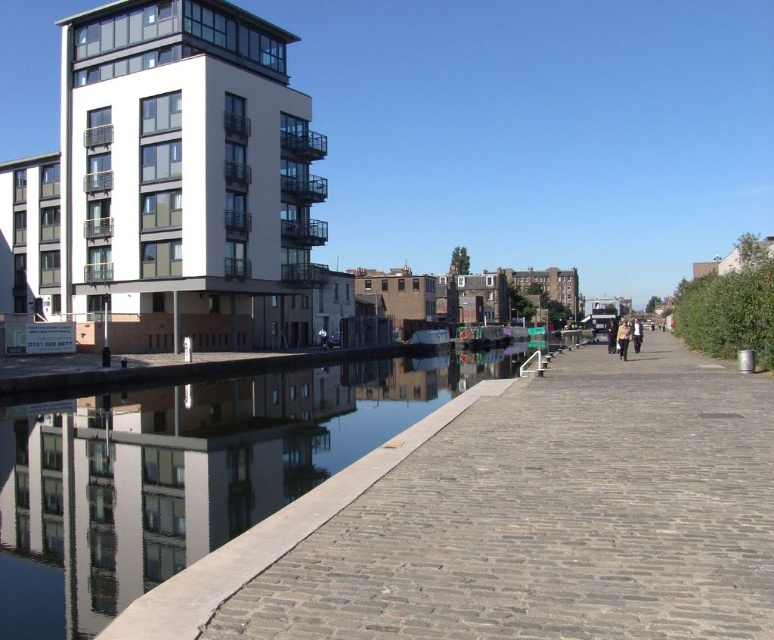
Question: Among these objects, which one is farthest from the camera?

Choices:
 (A) brown leather jacket at center
 (B) dark blue jeans at center

Answer: (B)

Question: Based on their relative distances, which object is nearer to the smooth concrete river at center?

Choices:
 (A) brown brick pavement at center
 (B) light brown leather jacket at center-right
 (C) dark blue jeans at center

Answer: (A)

Question: From the image, what is the correct spatial relationship of brown brick pavement at center in relation to smooth concrete river at center?

Choices:
 (A) left
 (B) right

Answer: (B)

Question: Which object is farther from the camera taking this photo?

Choices:
 (A) light brown leather jacket at center-right
 (B) smooth concrete river at center
 (C) brown leather jacket at center

Answer: (A)

Question: Considering the relative positions of brown brick pavement at center and brown leather jacket at center in the image provided, where is brown brick pavement at center located with respect to brown leather jacket at center?

Choices:
 (A) below
 (B) above

Answer: (A)

Question: Can you confirm if brown brick pavement at center is bigger than smooth concrete river at center?

Choices:
 (A) no
 (B) yes

Answer: (A)